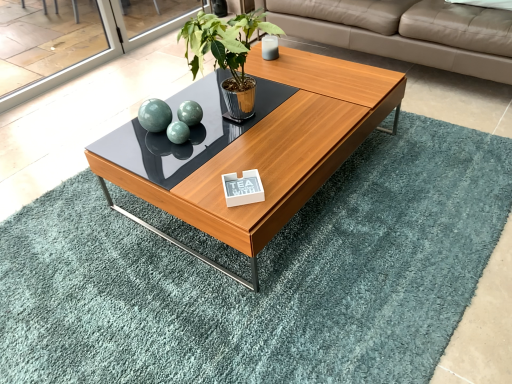
Locate an element on the screen. The height and width of the screenshot is (384, 512). free space to the back side of white glossy plaque at center is located at coordinates (237, 159).